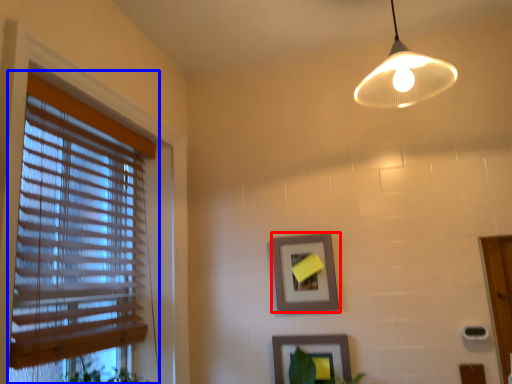
Question: Which point is closer to the camera, picture frame (highlighted by a red box) or window blind (highlighted by a blue box)?

Choices:
 (A) picture frame
 (B) window blind

Answer: (B)